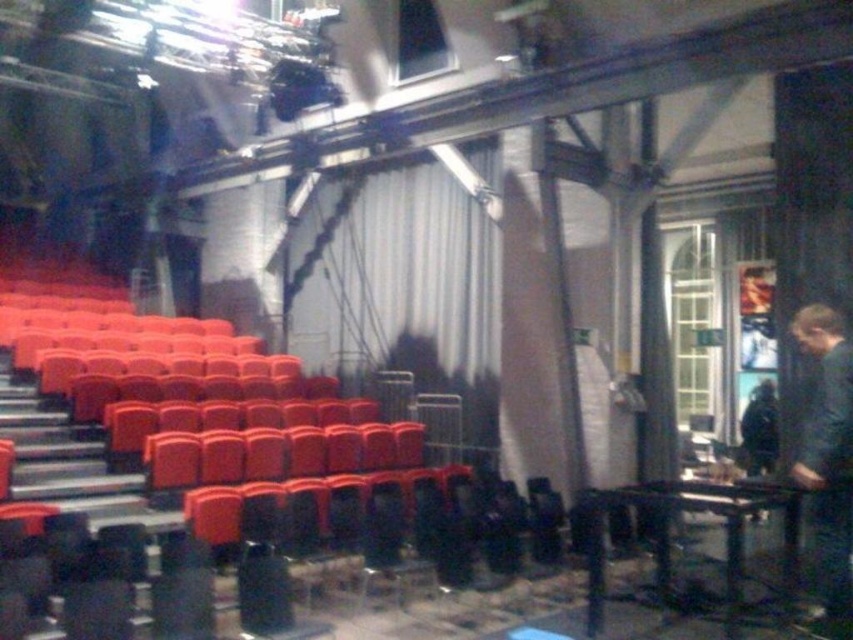
Does white matte curtain at center appear under dark blue fabric at right?

No, white matte curtain at center is not below dark blue fabric at right.

Can you confirm if white matte curtain at center is thinner than dark blue fabric at right?

Incorrect, white matte curtain at center's width is not less than dark blue fabric at right's.

Who is more forward, (447, 340) or (840, 349)?

Point (840, 349)

Where is `white matte curtain at center`? white matte curtain at center is located at coordinates (398, 285).